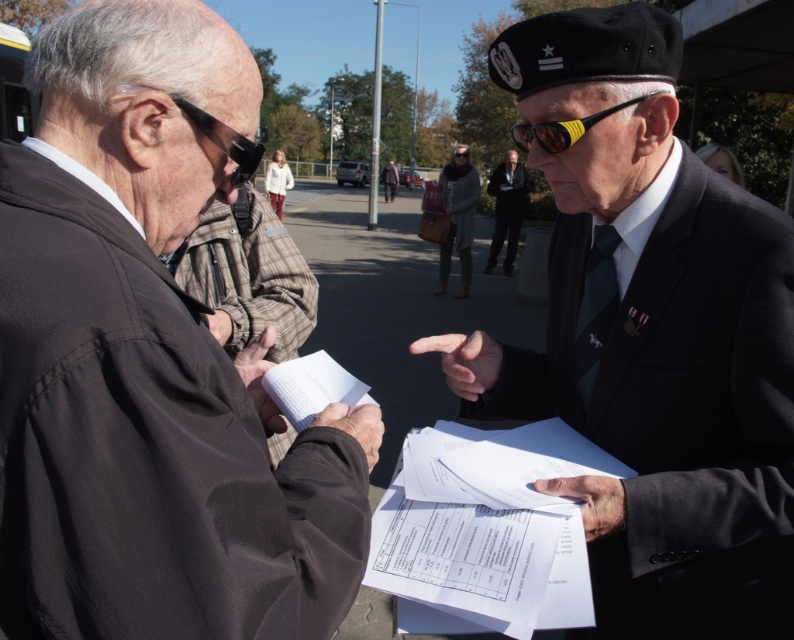
Question: Does white paper documents at center have a smaller size compared to black rubber goggles at left?

Choices:
 (A) yes
 (B) no

Answer: (B)

Question: Based on their relative distances, which object is nearer to the matte black jacket at left?

Choices:
 (A) white paper documents at center
 (B) yellow rubber goggles at center
 (C) gray woolen robe at center

Answer: (A)

Question: Which point is farther to the camera?

Choices:
 (A) (351, 536)
 (B) (463, 198)
 (C) (315, 397)

Answer: (B)

Question: From the image, what is the correct spatial relationship of matte black jacket at left in relation to white paper documents at center?

Choices:
 (A) right
 (B) left

Answer: (B)

Question: Which point is farther to the camera?

Choices:
 (A) dark gray suit at center
 (B) matte black jacket at left
 (C) brown plaid robe at center
 (D) gray woolen robe at center

Answer: (A)

Question: Does white paper at center appear over black rubber goggles at left?

Choices:
 (A) yes
 (B) no

Answer: (B)